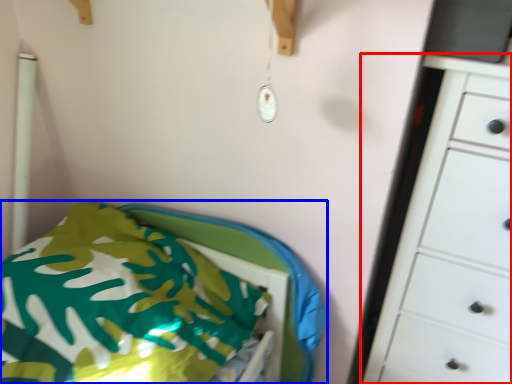
Question: Which object is closer to the camera taking this photo, chest of drawers (highlighted by a red box) or furniture (highlighted by a blue box)?

Choices:
 (A) chest of drawers
 (B) furniture

Answer: (A)